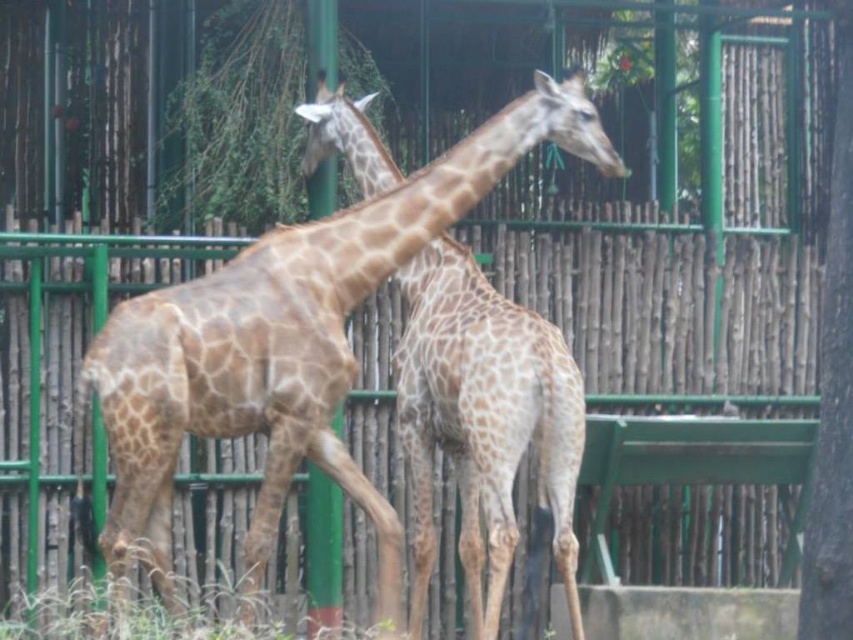
Looking at this image, between green bamboo fence at center and spotted fur giraffe at center, which one is positioned higher?

Positioned higher is green bamboo fence at center.

Can you confirm if green bamboo fence at center is wider than spotted fur giraffe at center?

Yes, green bamboo fence at center is wider than spotted fur giraffe at center.

In order to click on green bamboo fence at center in this screenshot , I will do `click(675, 384)`.